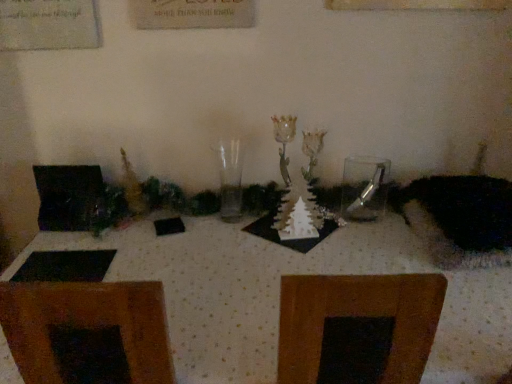
Question: From the image's perspective, would you say fuzzy black cat at right is shown under transparent glass vase at center?

Choices:
 (A) yes
 (B) no

Answer: (A)

Question: Considering the relative sizes of fuzzy black cat at right and transparent glass vase at center in the image provided, is fuzzy black cat at right thinner than transparent glass vase at center?

Choices:
 (A) no
 (B) yes

Answer: (A)

Question: Is fuzzy black cat at right with transparent glass vase at center?

Choices:
 (A) yes
 (B) no

Answer: (B)

Question: Is fuzzy black cat at right facing towards transparent glass vase at center?

Choices:
 (A) no
 (B) yes

Answer: (A)

Question: From a real-world perspective, is fuzzy black cat at right under transparent glass vase at center?

Choices:
 (A) no
 (B) yes

Answer: (B)

Question: From their relative heights in the image, would you say transparent glass vase at center is taller or shorter than white dotted fabric at center?

Choices:
 (A) tall
 (B) short

Answer: (B)

Question: From a real-world perspective, is transparent glass vase at center physically located above or below white dotted fabric at center?

Choices:
 (A) above
 (B) below

Answer: (A)

Question: In terms of width, does transparent glass vase at center look wider or thinner when compared to white dotted fabric at center?

Choices:
 (A) wide
 (B) thin

Answer: (B)

Question: Considering their positions, is transparent glass vase at center located in front of or behind white dotted fabric at center?

Choices:
 (A) front
 (B) behind

Answer: (B)

Question: From their relative heights in the image, would you say clear glass spoon at center is taller or shorter than transparent glass vase at center?

Choices:
 (A) short
 (B) tall

Answer: (A)

Question: Relative to transparent glass vase at center, is clear glass spoon at center in front or behind?

Choices:
 (A) behind
 (B) front

Answer: (A)

Question: Does point (375, 213) appear closer or farther from the camera than point (230, 167)?

Choices:
 (A) farther
 (B) closer

Answer: (B)

Question: Which is correct: clear glass spoon at center is inside transparent glass vase at center, or outside of it?

Choices:
 (A) outside
 (B) inside

Answer: (A)

Question: Is transparent glass vase at center taller or shorter than clear glass spoon at center?

Choices:
 (A) tall
 (B) short

Answer: (A)

Question: In terms of width, does transparent glass vase at center look wider or thinner when compared to clear glass spoon at center?

Choices:
 (A) thin
 (B) wide

Answer: (B)